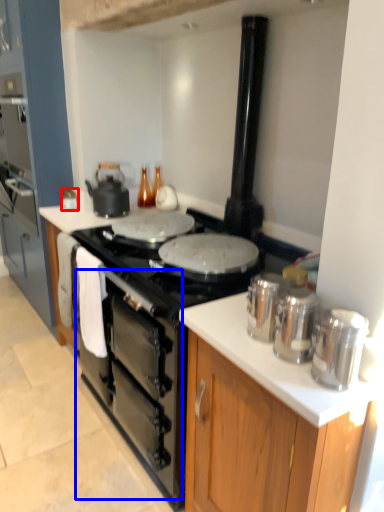
Question: Which object appears farthest to the camera in this image, kitchen appliance (highlighted by a red box) or oven (highlighted by a blue box)?

Choices:
 (A) kitchen appliance
 (B) oven

Answer: (A)